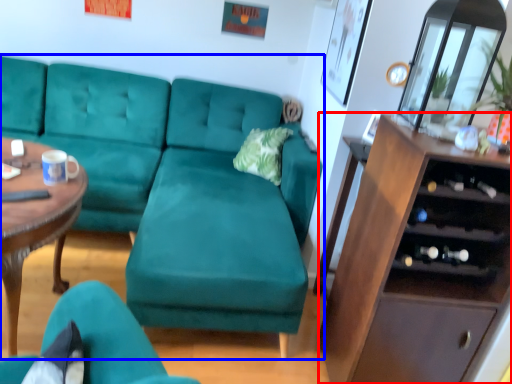
Question: Which object appears farthest to the camera in this image, cabinetry (highlighted by a red box) or studio couch (highlighted by a blue box)?

Choices:
 (A) cabinetry
 (B) studio couch

Answer: (B)